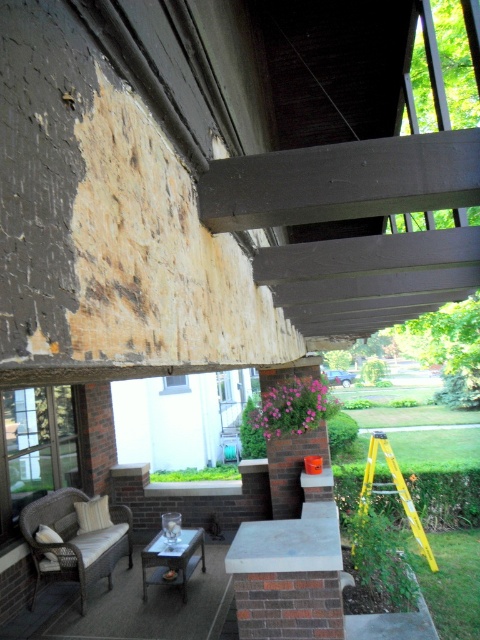
You are standing on the porch and want to move from the wicker cushioned chair at lower left to the yellow fiberglass ladder at lower right. Which direction should you move to reach the ladder?

The wicker cushioned chair at lower left is in front of the yellow fiberglass ladder at lower right, so to reach the ladder, you should move backward away from the ladder.

What are the coordinates of the wicker cushioned chair at lower left in the image?

The wicker cushioned chair at lower left is located at coordinates (74, 541).